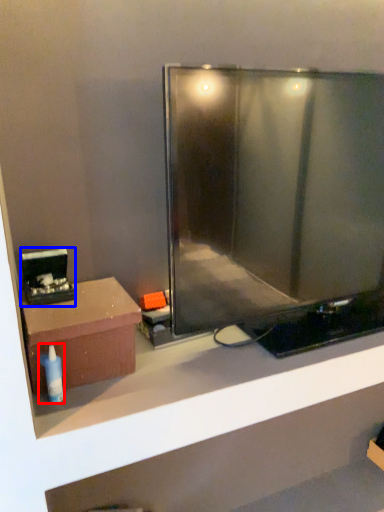
Question: Which of the following is the closest to the observer, toiletry (highlighted by a red box) or appliance (highlighted by a blue box)?

Choices:
 (A) toiletry
 (B) appliance

Answer: (A)